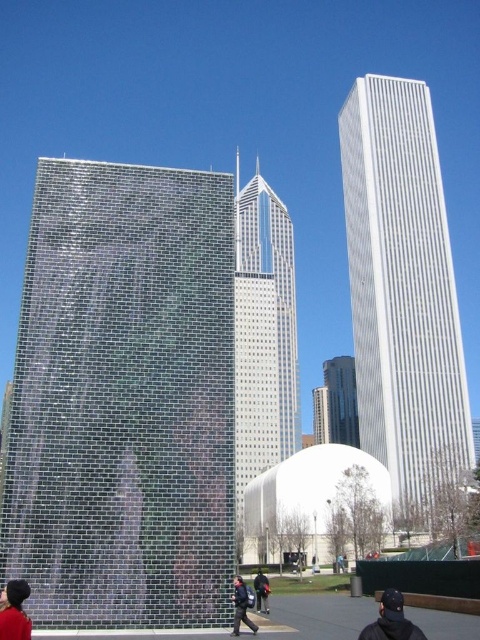
Question: Is reflective glass skyscraper at center bigger than black leather jacket at lower center?

Choices:
 (A) yes
 (B) no

Answer: (A)

Question: Can you confirm if glassy steel skyscraper at center is positioned below black fabric cap at center?

Choices:
 (A) yes
 (B) no

Answer: (B)

Question: Based on their relative distances, which object is farther from the white glossy skyscraper at right?

Choices:
 (A) dark blue uniform at center
 (B) glassy steel skyscraper at center
 (C) reflective glass skyscraper at center
 (D) reflective glass tower at center

Answer: (C)

Question: Which of the following is the farthest from the observer?

Choices:
 (A) reflective glass tower at center
 (B) white glossy skyscraper at right

Answer: (B)

Question: Among these points, which one is farthest from the camera?

Choices:
 (A) pyautogui.click(x=243, y=602)
 (B) pyautogui.click(x=337, y=564)
 (C) pyautogui.click(x=155, y=506)

Answer: (B)

Question: From the image, what is the correct spatial relationship of reflective glass skyscraper at center in relation to black fabric cap at center?

Choices:
 (A) above
 (B) below

Answer: (B)